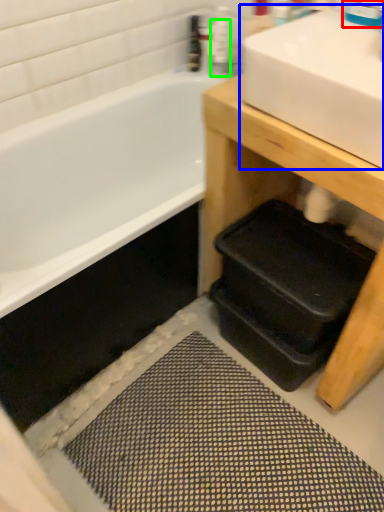
Question: Estimate the real-world distances between objects in this image. Which object is closer to faucet (highlighted by a red box), sink (highlighted by a blue box) or toiletry (highlighted by a green box)?

Choices:
 (A) sink
 (B) toiletry

Answer: (A)